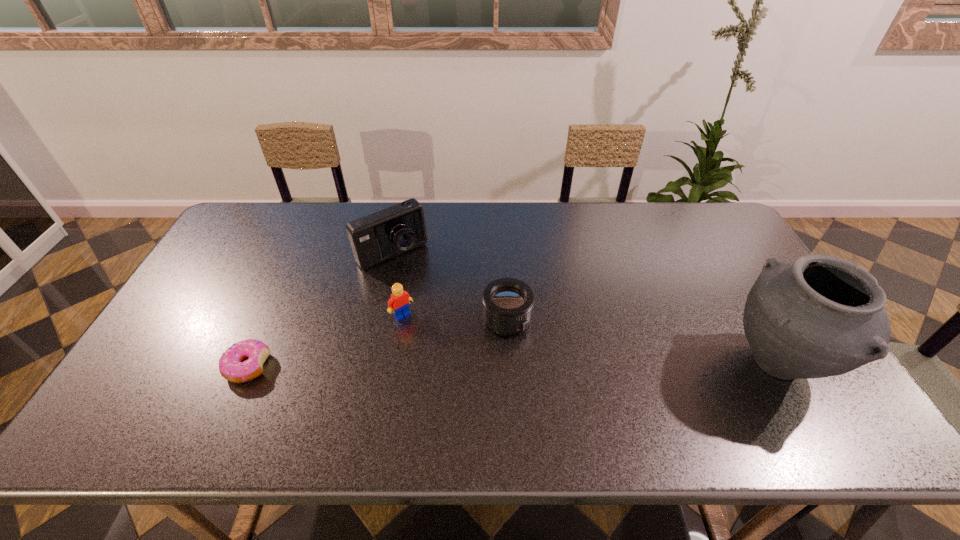
Image resolution: width=960 pixels, height=540 pixels. I want to click on object that ranks as the third closest to the urn, so click(x=382, y=235).

In order to click on object that ranks as the second closest to the third shortest object in this screenshot , I will do `click(507, 303)`.

The height and width of the screenshot is (540, 960). I want to click on free spot that satisfies the following two spatial constraints: 1. on the front side of the rightmost object; 2. on the left side of the fourth object from left to right, so click(x=510, y=363).

Identify the location of vacant region that satisfies the following two spatial constraints: 1. on the back side of the Lego; 2. on the right side of the leftmost object. (271, 315).

Identify the location of free location that satisfies the following two spatial constraints: 1. on the front side of the urn; 2. on the left side of the third tallest object. pyautogui.click(x=394, y=363).

At what (x,y) coordinates should I click in order to perform the action: click on free spot that satisfies the following two spatial constraints: 1. on the front side of the second shortest object; 2. on the left side of the rightmost object. Please return your answer as a coordinate pair (x, y). Looking at the image, I should click on (510, 363).